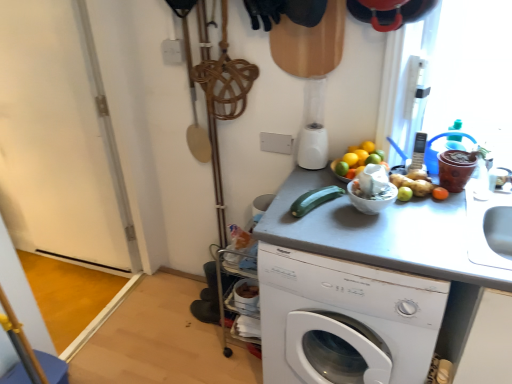
Locate an element on the screen. The image size is (512, 384). unoccupied area behind green matte cucumber at center is located at coordinates (308, 183).